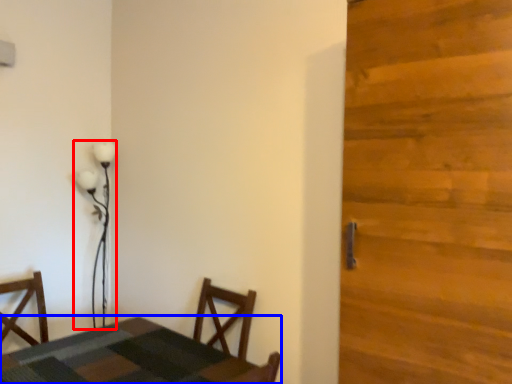
Question: Which object is closer to the camera taking this photo, lamp (highlighted by a red box) or table (highlighted by a blue box)?

Choices:
 (A) lamp
 (B) table

Answer: (B)